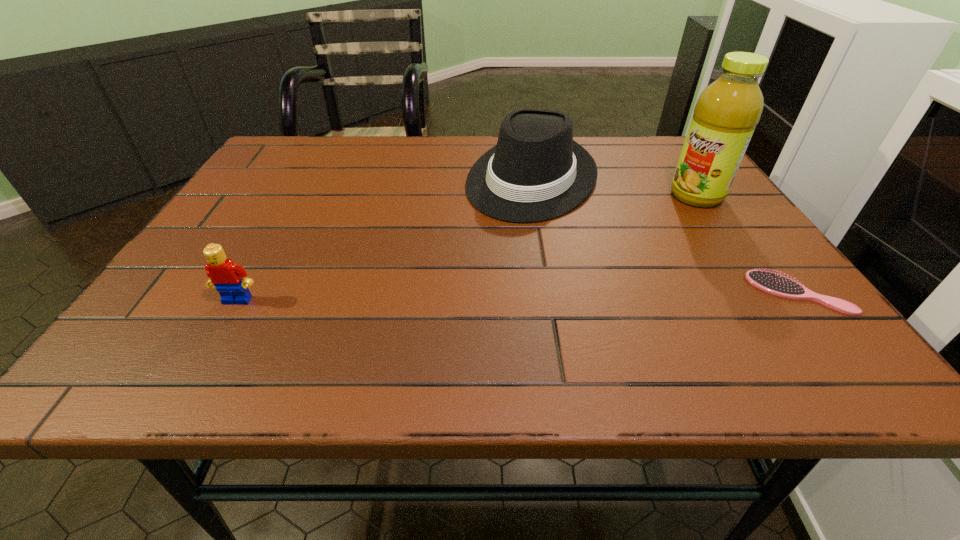
Identify the location of Lego. (224, 274).

Image resolution: width=960 pixels, height=540 pixels. What are the coordinates of `the third tallest object` in the screenshot? It's located at (224, 274).

Where is `hairbrush`? The height and width of the screenshot is (540, 960). hairbrush is located at coordinates (773, 283).

Find the location of `the third shortest object`. the third shortest object is located at coordinates (537, 172).

The image size is (960, 540). In order to click on the second object from left to right in this screenshot , I will do `click(537, 172)`.

Where is `fruit juice`? fruit juice is located at coordinates (725, 116).

I want to click on free location located on the back of the shortest object, so click(x=722, y=193).

The width and height of the screenshot is (960, 540). In order to click on free space located on the front-facing side of the second tallest object in this screenshot , I will do `click(495, 236)`.

At what (x,y) coordinates should I click in order to perform the action: click on free space located on the front-facing side of the second tallest object. Please return your answer as a coordinate pair (x, y). Image resolution: width=960 pixels, height=540 pixels. Looking at the image, I should click on (499, 231).

Where is `vacant position located on the front-facing side of the second tallest object`? Image resolution: width=960 pixels, height=540 pixels. vacant position located on the front-facing side of the second tallest object is located at coordinates (473, 267).